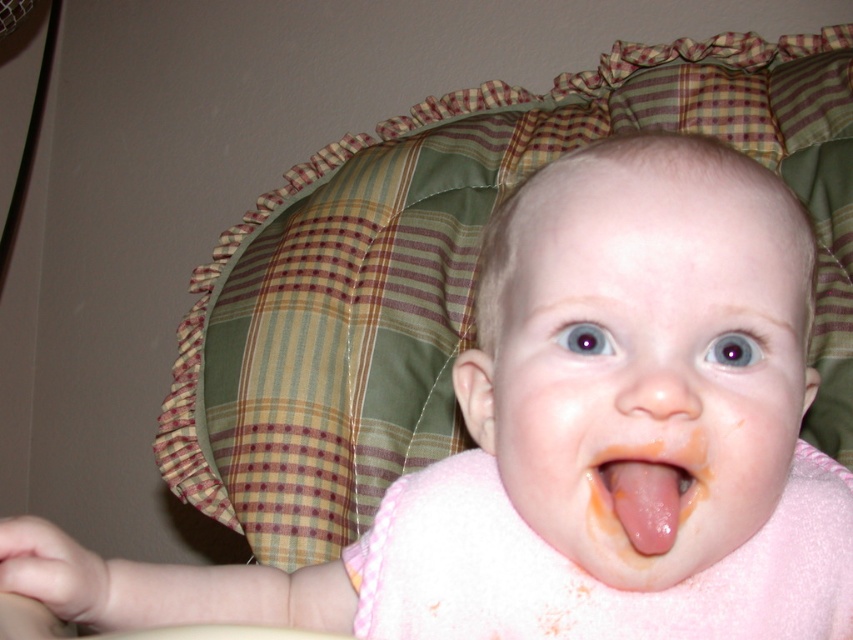
Question: Which point is farther to the camera?

Choices:
 (A) (614, 461)
 (B) (648, 243)

Answer: (A)

Question: Can you confirm if pink fabric at center is wider than pink smooth tongue at center?

Choices:
 (A) no
 (B) yes

Answer: (B)

Question: Which point is closer to the camera?

Choices:
 (A) pink smooth tongue at center
 (B) pink fabric at center

Answer: (B)

Question: Does pink fabric at center have a greater width compared to pink smooth tongue at center?

Choices:
 (A) no
 (B) yes

Answer: (B)

Question: Does pink fabric at center appear over pink smooth tongue at center?

Choices:
 (A) no
 (B) yes

Answer: (B)

Question: Which point appears farthest from the camera in this image?

Choices:
 (A) (531, 525)
 (B) (601, 477)

Answer: (A)